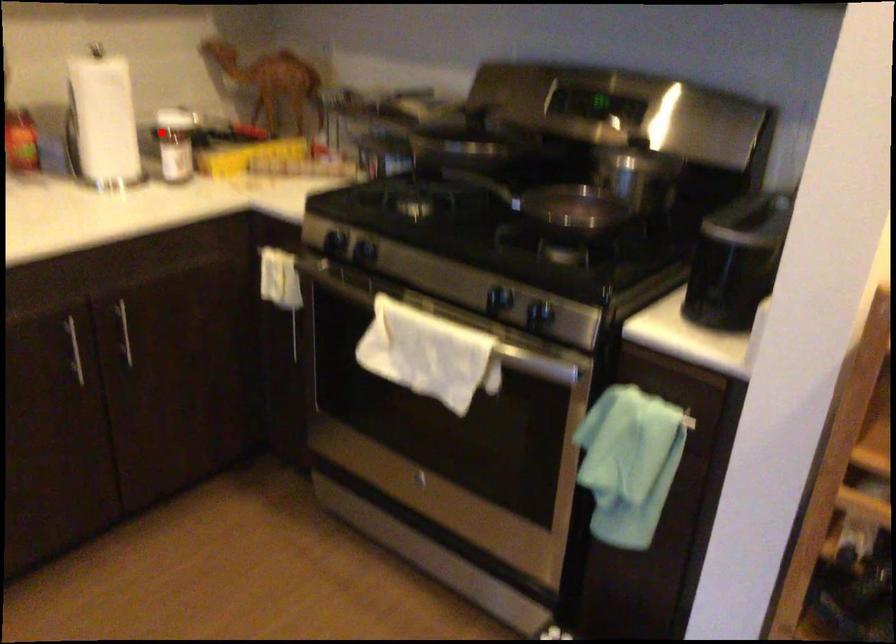
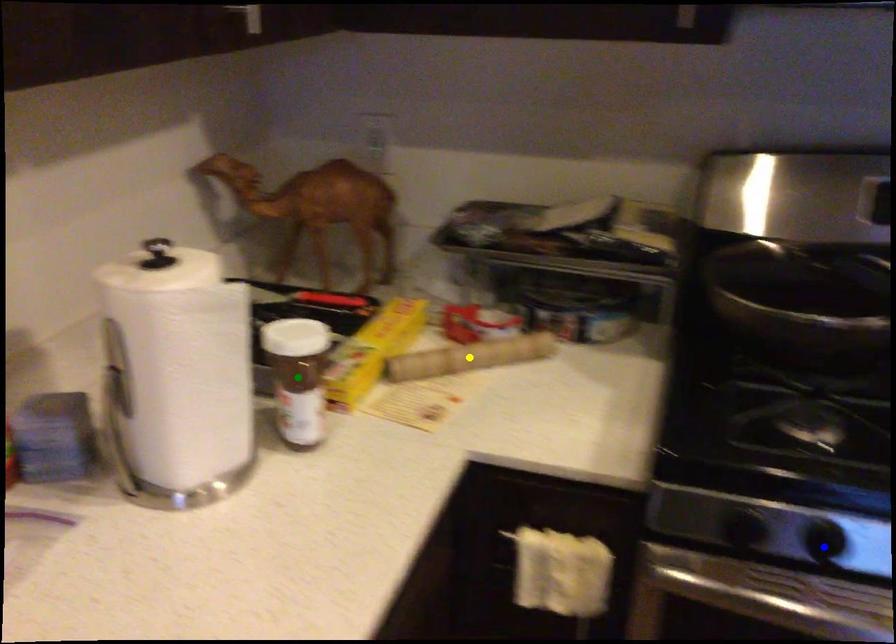
Question: I am providing you with two images of the same scene from different viewpoints. A red point is marked on the first image. You are given multiple points on the second image. In image 2, which mark is for the same physical point as the one in image 1?

Choices:
 (A) yellow point
 (B) blue point
 (C) green point

Answer: (C)